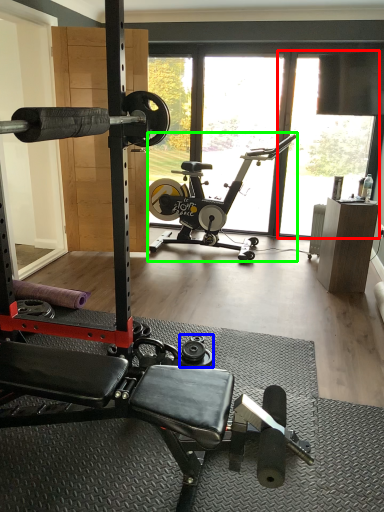
Question: Considering the real-world distances, which object is closest to window screen (highlighted by a red box)? dumbbell (highlighted by a blue box) or stationary bicycle (highlighted by a green box).

Choices:
 (A) dumbbell
 (B) stationary bicycle

Answer: (B)